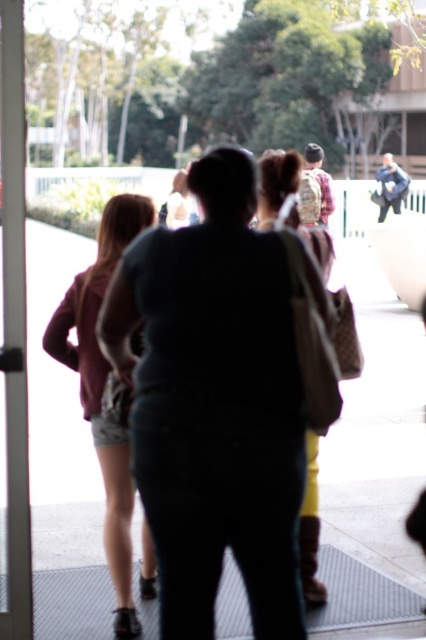
Which of these two, dark blue jeans at center or white glossy door at left, stands taller?

white glossy door at left

Is dark blue jeans at center thinner than white glossy door at left?

No, dark blue jeans at center is not thinner than white glossy door at left.

Is point (256, 410) positioned after point (23, 237)?

No, it is not.

Identify the location of dark blue jeans at center. This screenshot has height=640, width=426. (215, 403).

Can you confirm if dark blue jeans at center is wider than matte beige backpack at center?

Yes, dark blue jeans at center is wider than matte beige backpack at center.

Measure the distance between dark blue jeans at center and matte beige backpack at center.

dark blue jeans at center is 5.20 feet from matte beige backpack at center.

Describe the element at coordinates (215, 403) in the screenshot. I see `dark blue jeans at center` at that location.

Locate an element on the screen. Image resolution: width=426 pixels, height=640 pixels. dark blue jeans at center is located at coordinates (215, 403).

Is denim shorts at left in front of white glossy door at left?

No, it is behind white glossy door at left.

Can you confirm if denim shorts at left is positioned below white glossy door at left?

Correct, denim shorts at left is located below white glossy door at left.

You are a GUI agent. You are given a task and a screenshot of the screen. Output one action in this format:
    pyautogui.click(x=<x>, y=<y>)
    Task: Click on the denim shorts at left
    This screenshot has height=640, width=426.
    Given the screenshot: What is the action you would take?
    pyautogui.click(x=103, y=388)

Locate an element on the screen. This screenshot has height=640, width=426. denim shorts at left is located at coordinates (103, 388).